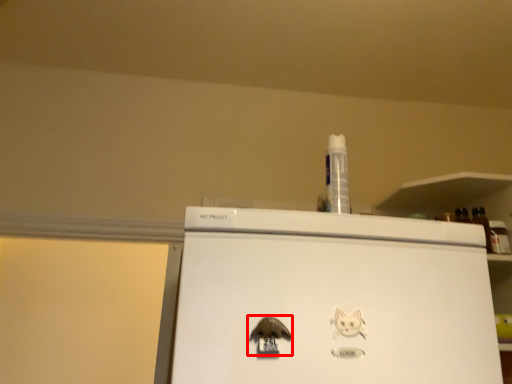
Question: From the image, what is the correct spatial relationship of animal (annotated by the red box) in relation to animal?

Choices:
 (A) right
 (B) left

Answer: (B)